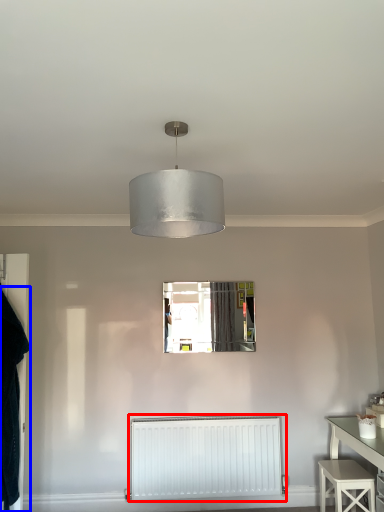
Question: Which object appears closest to the camera in this image, radiator (highlighted by a red box) or clothing (highlighted by a blue box)?

Choices:
 (A) radiator
 (B) clothing

Answer: (B)